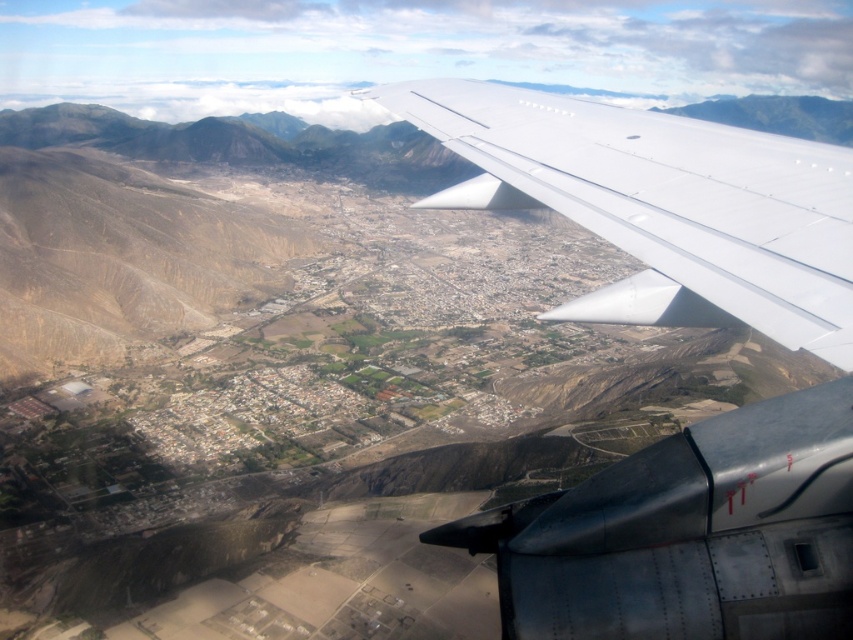
Who is shorter, white metallic wing at upper center or transparent plastic airplane window at lower right?

With less height is transparent plastic airplane window at lower right.

Does point (636, 280) come in front of point (799, 541)?

No, (636, 280) is further to viewer.

Image resolution: width=853 pixels, height=640 pixels. I want to click on white metallic wing at upper center, so click(x=679, y=324).

Image resolution: width=853 pixels, height=640 pixels. Identify the location of white metallic wing at upper center. (679, 324).